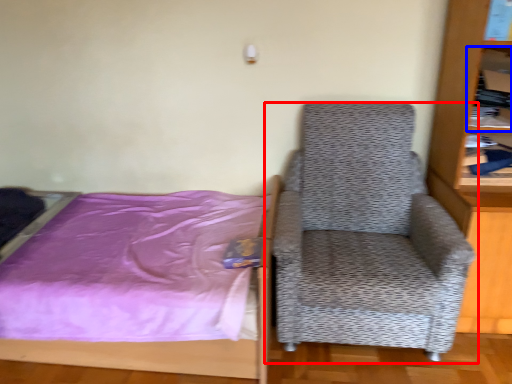
Question: Which point is further to the camera, chair (highlighted by a red box) or shelf (highlighted by a blue box)?

Choices:
 (A) chair
 (B) shelf

Answer: (B)